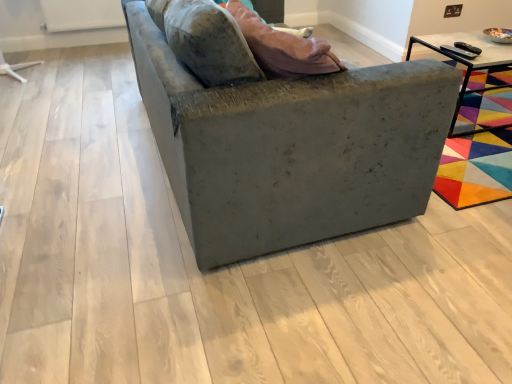
Question: Considering the positions of black metal table at upper right and velvet gray couch at center in the image, is black metal table at upper right taller or shorter than velvet gray couch at center?

Choices:
 (A) short
 (B) tall

Answer: (A)

Question: In the image, is black metal table at upper right positioned in front of or behind velvet gray couch at center?

Choices:
 (A) front
 (B) behind

Answer: (B)

Question: From the image's perspective, relative to velvet gray couch at center, is black metal table at upper right above or below?

Choices:
 (A) below
 (B) above

Answer: (B)

Question: From their relative heights in the image, would you say velvet gray couch at center is taller or shorter than black metal table at upper right?

Choices:
 (A) short
 (B) tall

Answer: (B)

Question: From the image's perspective, is velvet gray couch at center located above or below black metal table at upper right?

Choices:
 (A) below
 (B) above

Answer: (A)

Question: Is point (275, 235) closer or farther from the camera than point (410, 49)?

Choices:
 (A) farther
 (B) closer

Answer: (B)

Question: Is velvet gray couch at center bigger or smaller than black metal table at upper right?

Choices:
 (A) small
 (B) big

Answer: (B)